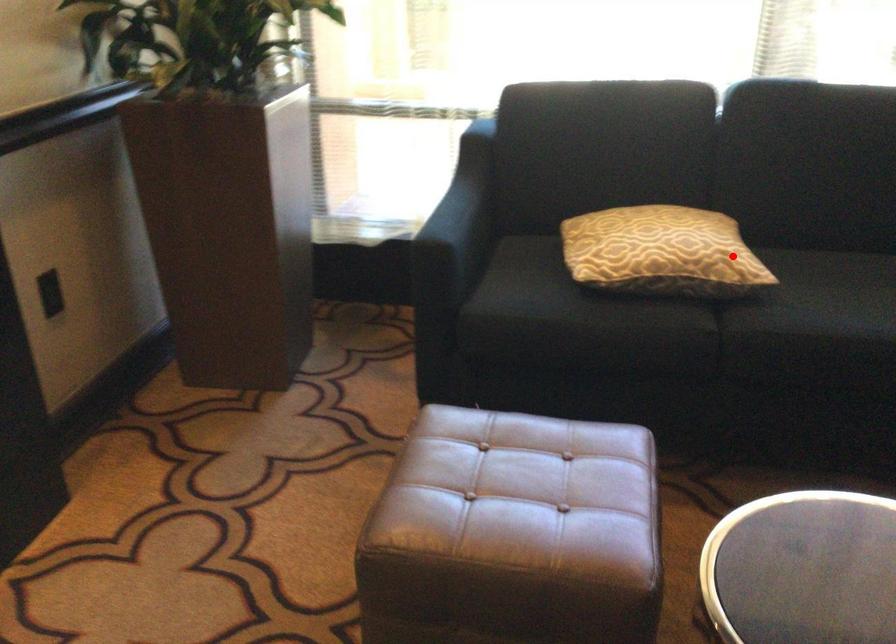
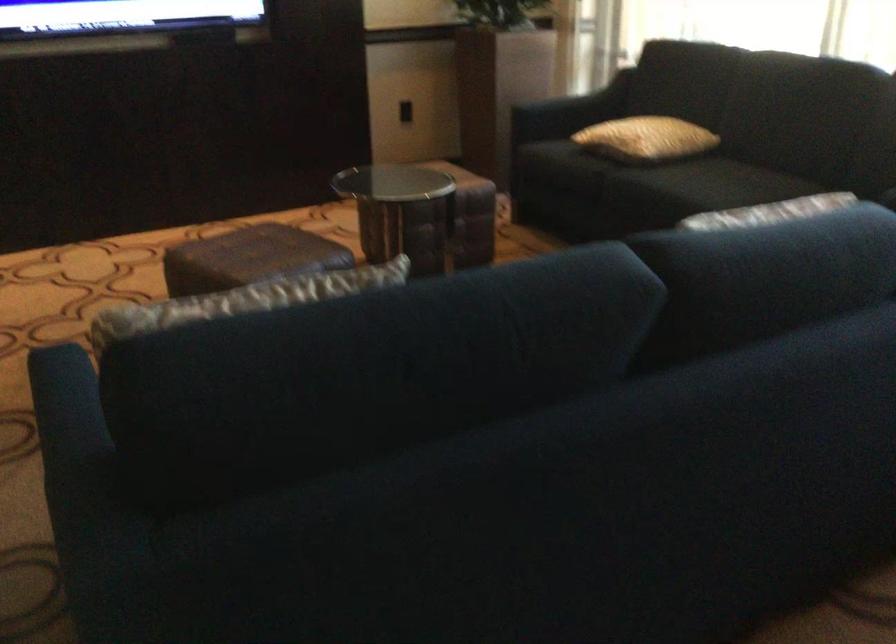
Question: I am providing you with two images of the same scene from different viewpoints. A red point is shown in image1. For the corresponding object point in image2, is it positioned nearer or farther from the camera?

Choices:
 (A) Nearer
 (B) Farther

Answer: (B)